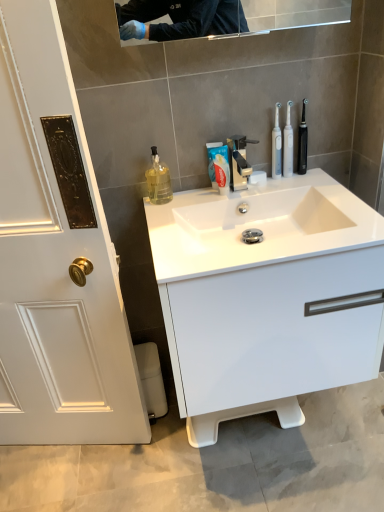
Where is `vacant space in front of white plastic toothbrush at upper right, which appears as the first toothbrush when viewed from the left`? This screenshot has height=512, width=384. vacant space in front of white plastic toothbrush at upper right, which appears as the first toothbrush when viewed from the left is located at coordinates tap(306, 189).